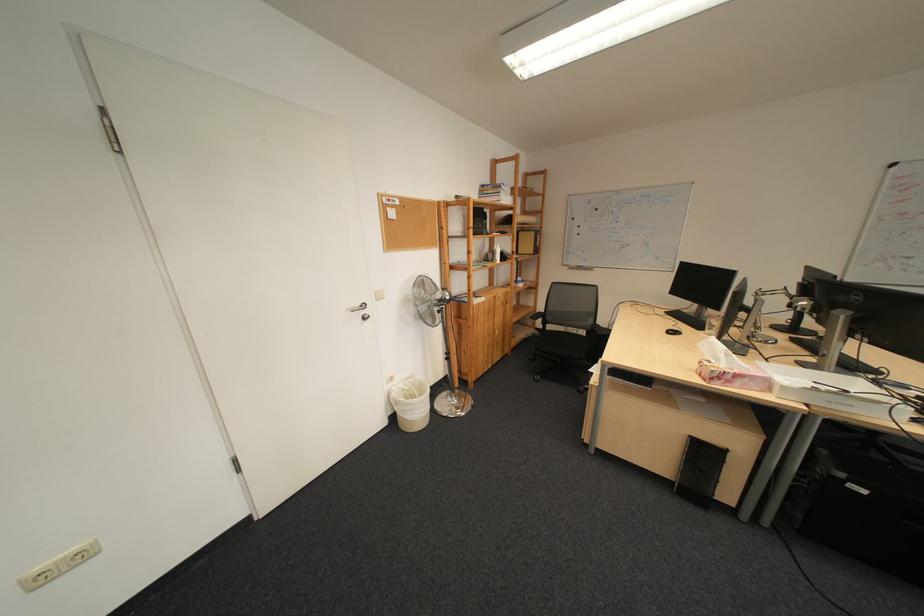
The width and height of the screenshot is (924, 616). What do you see at coordinates (58, 565) in the screenshot?
I see `the wall power outlet` at bounding box center [58, 565].